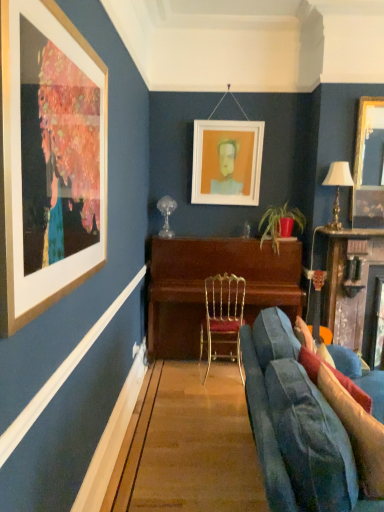
Question: Does velvet red pillow at lower right, which is the 1th pillow in back-to-front order, have a greater height compared to matte white picture frame at center, which is counted as the 1th picture frame, starting from the back?

Choices:
 (A) no
 (B) yes

Answer: (A)

Question: Is velvet red pillow at lower right, which is the 1th pillow in back-to-front order, outside matte white picture frame at center, marked as the first picture frame in a left-to-right arrangement?

Choices:
 (A) yes
 (B) no

Answer: (A)

Question: Considering the relative sizes of velvet red pillow at lower right, which is the 1th pillow in back-to-front order, and matte white picture frame at center, which is counted as the 1th picture frame, starting from the back, in the image provided, is velvet red pillow at lower right, which is the 1th pillow in back-to-front order, bigger than matte white picture frame at center, which is counted as the 1th picture frame, starting from the back,?

Choices:
 (A) no
 (B) yes

Answer: (A)

Question: From a real-world perspective, is velvet red pillow at lower right, the second pillow viewed from the front, positioned under matte white picture frame at center, the 2th picture frame from the front, based on gravity?

Choices:
 (A) yes
 (B) no

Answer: (A)

Question: Could you tell me if velvet red pillow at lower right, the second pillow viewed from the front, is facing matte white picture frame at center, the 2th picture frame from the front?

Choices:
 (A) no
 (B) yes

Answer: (A)

Question: Based on their sizes in the image, would you say velvet red pillow at lower right, the second pillow viewed from the front, is bigger or smaller than velvet blue pillow at lower right, the second pillow positioned from the back?

Choices:
 (A) big
 (B) small

Answer: (B)

Question: Considering the positions of point (304, 352) and point (375, 437), is point (304, 352) closer or farther from the camera than point (375, 437)?

Choices:
 (A) closer
 (B) farther

Answer: (B)

Question: Is velvet red pillow at lower right, the second pillow viewed from the front, in front of or behind velvet blue pillow at lower right, which is counted as the 1th pillow, starting from the front, in the image?

Choices:
 (A) behind
 (B) front

Answer: (A)

Question: From the image's perspective, is velvet red pillow at lower right, which is the 1th pillow in back-to-front order, located above or below velvet blue pillow at lower right, which is counted as the 1th pillow, starting from the front?

Choices:
 (A) above
 (B) below

Answer: (A)

Question: From a real-world perspective, is wooden piano at center physically located above or below wooden table at right?

Choices:
 (A) below
 (B) above

Answer: (A)

Question: Considering the positions of point (185, 301) and point (355, 230), is point (185, 301) closer or farther from the camera than point (355, 230)?

Choices:
 (A) farther
 (B) closer

Answer: (A)

Question: From the image's perspective, is wooden piano at center above or below wooden table at right?

Choices:
 (A) above
 (B) below

Answer: (A)

Question: Considering their positions, is wooden piano at center located in front of or behind wooden table at right?

Choices:
 (A) front
 (B) behind

Answer: (B)

Question: Is gold-framed mirror at upper right, placed as the 1th picture frame when sorted from right to left, in front of or behind velvet blue couch at lower right in the image?

Choices:
 (A) behind
 (B) front

Answer: (A)

Question: Is gold-framed mirror at upper right, placed as the 1th picture frame when sorted from right to left, bigger or smaller than velvet blue couch at lower right?

Choices:
 (A) small
 (B) big

Answer: (A)